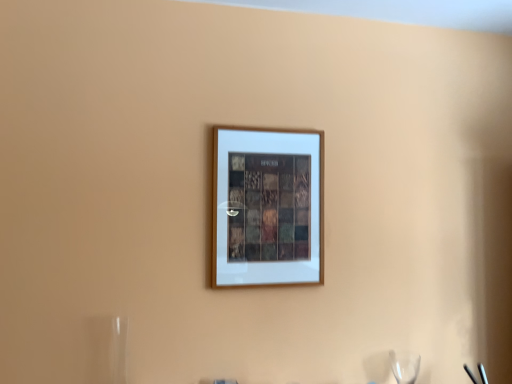
This screenshot has height=384, width=512. What do you see at coordinates (267, 207) in the screenshot?
I see `wooden picture frame at center` at bounding box center [267, 207].

Where is `wooden picture frame at center`? This screenshot has height=384, width=512. wooden picture frame at center is located at coordinates (267, 207).

What is the approximate height of wooden picture frame at center?

It is 29.21 inches.

This screenshot has width=512, height=384. I want to click on transparent glass wine glass at lower right, so click(x=404, y=366).

The image size is (512, 384). What do you see at coordinates (404, 366) in the screenshot?
I see `transparent glass wine glass at lower right` at bounding box center [404, 366].

Where is `wooden picture frame at center`? The width and height of the screenshot is (512, 384). wooden picture frame at center is located at coordinates (267, 207).

Does wooden picture frame at center appear on the left side of transparent glass wine glass at lower right?

Yes, wooden picture frame at center is to the left of transparent glass wine glass at lower right.

Is wooden picture frame at center in front of transparent glass wine glass at lower right?

Yes, wooden picture frame at center is in front of transparent glass wine glass at lower right.

Does point (246, 177) appear closer or farther from the camera than point (396, 361)?

Point (246, 177) appears to be closer to the viewer than point (396, 361).

From the image's perspective, who appears lower, wooden picture frame at center or transparent glass wine glass at lower right?

From the image's view, transparent glass wine glass at lower right is below.

From a real-world perspective, is wooden picture frame at center on top of transparent glass wine glass at lower right?

Correct, in the physical world, wooden picture frame at center is higher than transparent glass wine glass at lower right.

Between wooden picture frame at center and transparent glass wine glass at lower right, which one has smaller width?

With smaller width is wooden picture frame at center.

From the picture: Considering the relative sizes of wooden picture frame at center and transparent glass wine glass at lower right in the image provided, is wooden picture frame at center shorter than transparent glass wine glass at lower right?

No.

Considering the sizes of wooden picture frame at center and transparent glass wine glass at lower right in the image, is wooden picture frame at center bigger or smaller than transparent glass wine glass at lower right?

Clearly, wooden picture frame at center is larger in size than transparent glass wine glass at lower right.

Is transparent glass wine glass at lower right located within wooden picture frame at center?

Actually, transparent glass wine glass at lower right is outside wooden picture frame at center.

Are wooden picture frame at center and transparent glass wine glass at lower right far apart?

wooden picture frame at center is actually quite close to transparent glass wine glass at lower right.

Is wooden picture frame at center aimed at transparent glass wine glass at lower right?

No, wooden picture frame at center is not facing towards transparent glass wine glass at lower right.

How many degrees apart are the facing directions of wooden picture frame at center and transparent glass wine glass at lower right?

0.907 degrees.

Where is `picture frame above the transparent glass wine glass at lower right (from the image's perspective)`? The height and width of the screenshot is (384, 512). picture frame above the transparent glass wine glass at lower right (from the image's perspective) is located at coordinates (267, 207).

Does transparent glass wine glass at lower right appear on the right side of wooden picture frame at center?

Correct, you'll find transparent glass wine glass at lower right to the right of wooden picture frame at center.

Relative to wooden picture frame at center, is transparent glass wine glass at lower right in front or behind?

In the image, transparent glass wine glass at lower right appears behind wooden picture frame at center.

Is point (414, 375) positioned before point (301, 171)?

No, (414, 375) is further to viewer.

From the image's perspective, which one is positioned lower, transparent glass wine glass at lower right or wooden picture frame at center?

From the image's view, transparent glass wine glass at lower right is below.

Consider the image. From a real-world perspective, between transparent glass wine glass at lower right and wooden picture frame at center, who is vertically lower?

transparent glass wine glass at lower right.

Considering the sizes of objects transparent glass wine glass at lower right and wooden picture frame at center in the image provided, who is thinner, transparent glass wine glass at lower right or wooden picture frame at center?

wooden picture frame at center is thinner.

From their relative heights in the image, would you say transparent glass wine glass at lower right is taller or shorter than wooden picture frame at center?

transparent glass wine glass at lower right is shorter than wooden picture frame at center.

Who is bigger, transparent glass wine glass at lower right or wooden picture frame at center?

With larger size is wooden picture frame at center.

Based on the photo, can wooden picture frame at center be found inside transparent glass wine glass at lower right?

No, wooden picture frame at center is not inside transparent glass wine glass at lower right.

Is the surface of transparent glass wine glass at lower right in direct contact with wooden picture frame at center?

transparent glass wine glass at lower right is not next to wooden picture frame at center, and they're not touching.

Is wooden picture frame at center at the back of transparent glass wine glass at lower right?

No, transparent glass wine glass at lower right is not facing away from wooden picture frame at center.

How many degrees apart are the facing directions of transparent glass wine glass at lower right and wooden picture frame at center?

0.907 degrees.

The height and width of the screenshot is (384, 512). I want to click on picture frame above the transparent glass wine glass at lower right (from a real-world perspective), so click(267, 207).

The image size is (512, 384). I want to click on picture frame on the left of transparent glass wine glass at lower right, so click(x=267, y=207).

Locate an element on the screen. wine glass below the wooden picture frame at center (from the image's perspective) is located at coordinates (404, 366).